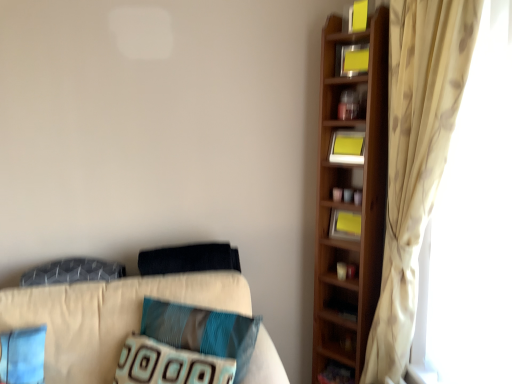
Question: Is beige floral curtain at right completely or partially inside yellow matte bookshelf at upper right, the second book when ordered from top to bottom?

Choices:
 (A) no
 (B) yes

Answer: (A)

Question: From a real-world perspective, is yellow matte bookshelf at upper right, which is the 3th book in bottom-to-top order, beneath beige floral curtain at right?

Choices:
 (A) yes
 (B) no

Answer: (B)

Question: Is yellow matte bookshelf at upper right, which is the 3th book in bottom-to-top order, wider than beige floral curtain at right?

Choices:
 (A) yes
 (B) no

Answer: (B)

Question: From a real-world perspective, is yellow matte bookshelf at upper right, the second book when ordered from top to bottom, over beige floral curtain at right?

Choices:
 (A) no
 (B) yes

Answer: (B)

Question: Is yellow matte bookshelf at upper right, the second book when ordered from top to bottom, positioned before beige floral curtain at right?

Choices:
 (A) no
 (B) yes

Answer: (A)

Question: Considering the positions of teal fabric pillow at center, the second pillow from the bottom, and textured gray pillow at left, positioned as the third pillow in bottom-to-top order, in the image, is teal fabric pillow at center, the second pillow from the bottom, taller or shorter than textured gray pillow at left, positioned as the third pillow in bottom-to-top order,?

Choices:
 (A) short
 (B) tall

Answer: (B)

Question: Is teal fabric pillow at center, which is the third pillow in top-to-bottom order, to the left or to the right of textured gray pillow at left, the second pillow positioned from the top, in the image?

Choices:
 (A) right
 (B) left

Answer: (A)

Question: Does point (236, 339) appear closer or farther from the camera than point (77, 276)?

Choices:
 (A) closer
 (B) farther

Answer: (A)

Question: Do you think teal fabric pillow at center, the second pillow from the bottom, is within textured gray pillow at left, positioned as the third pillow in bottom-to-top order, or outside of it?

Choices:
 (A) inside
 (B) outside

Answer: (B)

Question: From the image's perspective, is yellow paper at upper right, positioned as the 1th book in bottom-to-top order, positioned above or below textured gray pillow at left, the second pillow positioned from the top?

Choices:
 (A) below
 (B) above

Answer: (B)

Question: Based on their positions, is yellow paper at upper right, which ranks as the fourth book in top-to-bottom order, located to the left or right of textured gray pillow at left, the second pillow positioned from the top?

Choices:
 (A) left
 (B) right

Answer: (B)

Question: Is yellow paper at upper right, positioned as the 1th book in bottom-to-top order, taller or shorter than textured gray pillow at left, positioned as the third pillow in bottom-to-top order?

Choices:
 (A) short
 (B) tall

Answer: (B)

Question: Is point (352, 238) closer or farther from the camera than point (65, 259)?

Choices:
 (A) farther
 (B) closer

Answer: (A)

Question: Is point (223, 360) positioned closer to the camera than point (340, 74)?

Choices:
 (A) farther
 (B) closer

Answer: (B)

Question: From a real-world perspective, relative to yellow matte bookshelf at upper right, which is the 3th book in bottom-to-top order, is textured blue pillow at center, acting as the 4th pillow starting from the top, vertically above or below?

Choices:
 (A) above
 (B) below

Answer: (B)